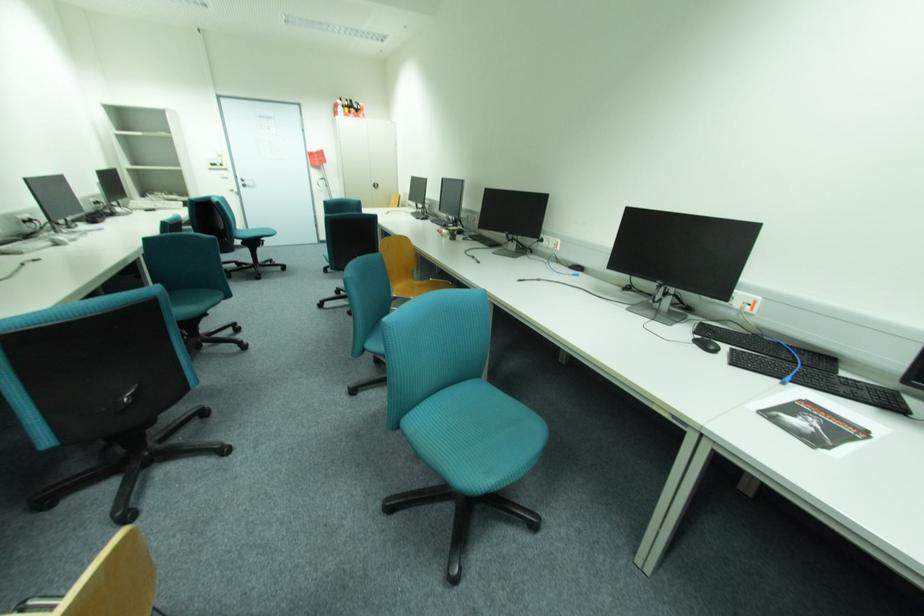
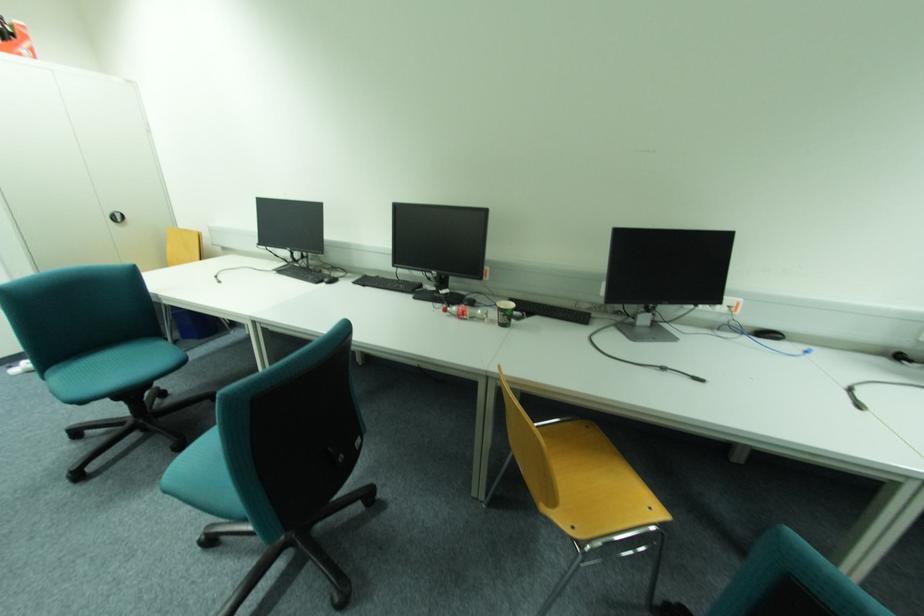
Locate, in the second image, the point that corresponds to (427,217) in the first image.

(333, 280)